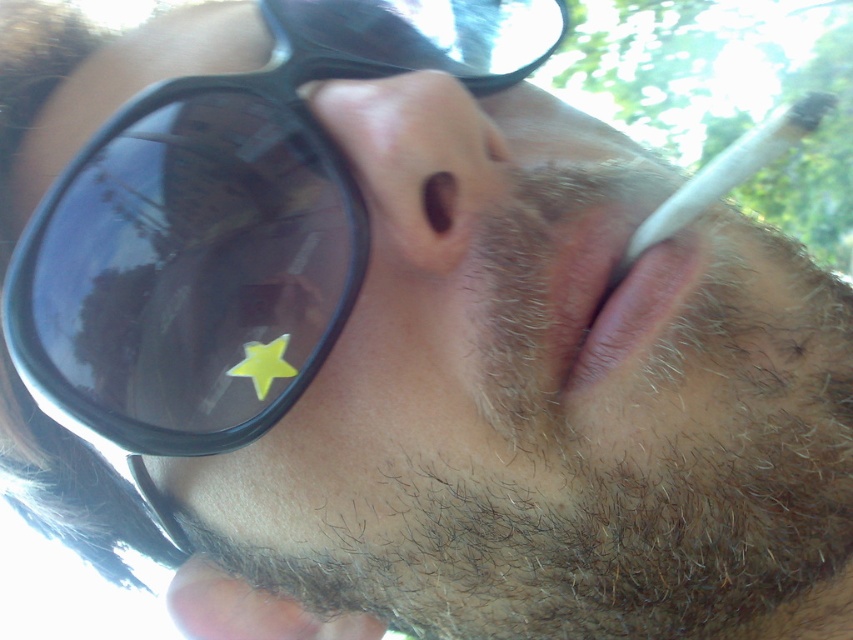
Question: Does pink smooth lips at center have a lesser width compared to yellow matte star at lower left?

Choices:
 (A) yes
 (B) no

Answer: (B)

Question: Can you confirm if black matte sunglasses at upper left is wider than yellow matte star at lower left?

Choices:
 (A) no
 (B) yes

Answer: (B)

Question: Which of the following is the closest to the observer?

Choices:
 (A) (222, 362)
 (B) (247, 372)

Answer: (A)

Question: In this image, where is brown matte nose at center located relative to pink smooth lips at center?

Choices:
 (A) left
 (B) right

Answer: (A)

Question: Which point appears closest to the camera in this image?

Choices:
 (A) (409, 241)
 (B) (647, 234)

Answer: (A)

Question: Which point is closer to the camera?

Choices:
 (A) (370, 28)
 (B) (688, 180)
 (C) (555, 320)
 (D) (445, 243)

Answer: (C)